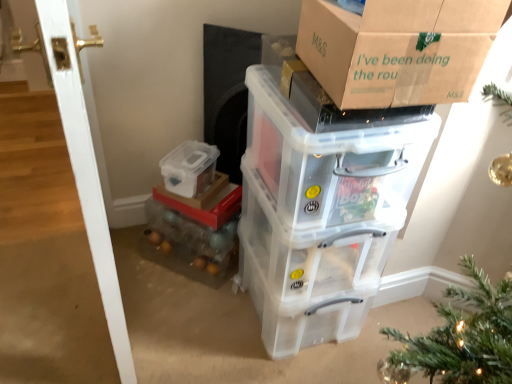
Where is `blank space to the left of transparent plastic storage box at center, which is counted as the first storage box, starting from the bottom`? This screenshot has height=384, width=512. blank space to the left of transparent plastic storage box at center, which is counted as the first storage box, starting from the bottom is located at coordinates (184, 319).